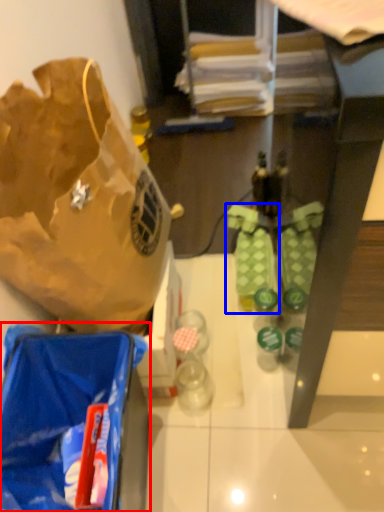
Question: Which object is further to the camera taking this photo, luggage and bags (highlighted by a red box) or footwear (highlighted by a blue box)?

Choices:
 (A) luggage and bags
 (B) footwear

Answer: (B)